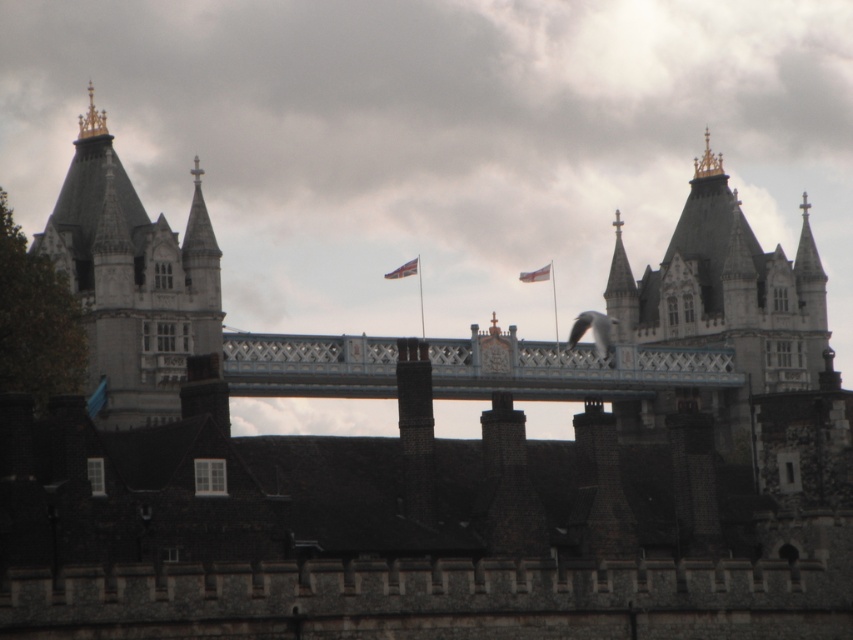
Between white stone tower at upper left and white painted metal bridge at center, which one is positioned lower?

Answer: white painted metal bridge at center is below.

Is point (90, 156) closer to camera compared to point (531, 380)?

Yes, it is in front of point (531, 380).

Find the location of `white stone tower at upper left`. white stone tower at upper left is located at coordinates (132, 282).

Find the location of a particular element. The width and height of the screenshot is (853, 640). white stone tower at upper left is located at coordinates (132, 282).

Can you confirm if white stone tower at upper left is shorter than red fabric flag at center?

In fact, white stone tower at upper left may be taller than red fabric flag at center.

Where is `white stone tower at upper left`? This screenshot has width=853, height=640. white stone tower at upper left is located at coordinates (132, 282).

Can you confirm if white painted metal bridge at center is positioned to the left of red fabric flag at center?

A: Incorrect, white painted metal bridge at center is not on the left side of red fabric flag at center.

The height and width of the screenshot is (640, 853). In order to click on white painted metal bridge at center in this screenshot , I will do `click(567, 369)`.